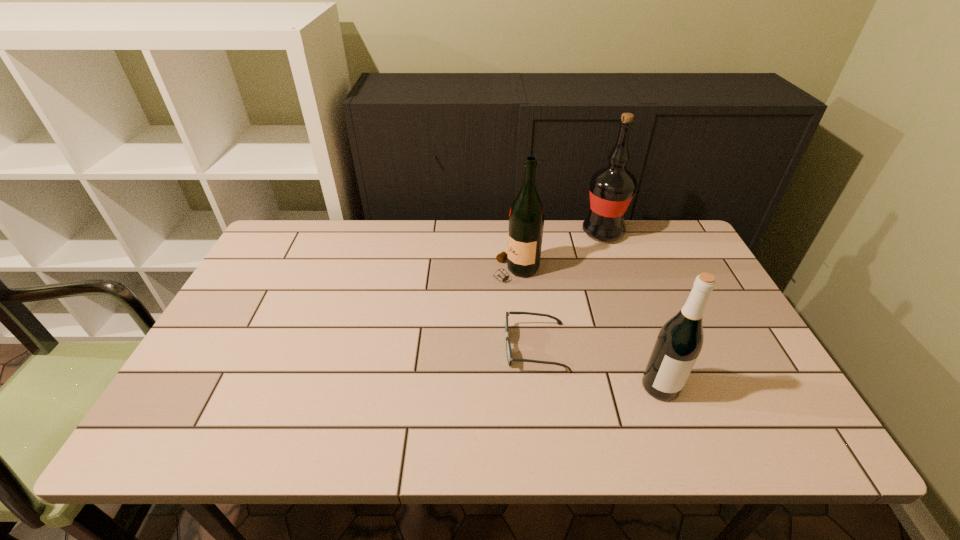
The width and height of the screenshot is (960, 540). Find the location of `the farthest wine bottle`. the farthest wine bottle is located at coordinates pos(611,188).

The image size is (960, 540). What are the coordinates of `the second farthest object` in the screenshot? It's located at (526, 218).

The height and width of the screenshot is (540, 960). What are the coordinates of `the leftmost wine bottle` in the screenshot? It's located at coord(526,218).

Identify the location of the nearest wine bottle. This screenshot has height=540, width=960. (679, 343).

The height and width of the screenshot is (540, 960). I want to click on the shortest object, so click(x=508, y=346).

Find the location of a particular element. The image size is (960, 540). vacant space located on the left of the farthest wine bottle is located at coordinates (533, 233).

At what (x,y) coordinates should I click in order to perform the action: click on vacant space located on the surface of the second nearest wine bottle. Please return your answer as a coordinate pair (x, y). The width and height of the screenshot is (960, 540). Looking at the image, I should click on (472, 270).

You are a GUI agent. You are given a task and a screenshot of the screen. Output one action in this format:
    pyautogui.click(x=<x>, y=<y>)
    Task: Click on the free spot located 0.370m on the surface of the second nearest wine bottle
    
    Given the screenshot: What is the action you would take?
    coord(369,270)

You are a GUI agent. You are given a task and a screenshot of the screen. Output one action in this format:
    pyautogui.click(x=<x>, y=<y>)
    Task: Click on the free space located on the surface of the second nearest wine bottle
    The image size is (960, 540).
    Given the screenshot: What is the action you would take?
    pyautogui.click(x=432, y=270)

This screenshot has width=960, height=540. In order to click on free space located on the label of the nearest wine bottle in this screenshot , I will do `click(677, 432)`.